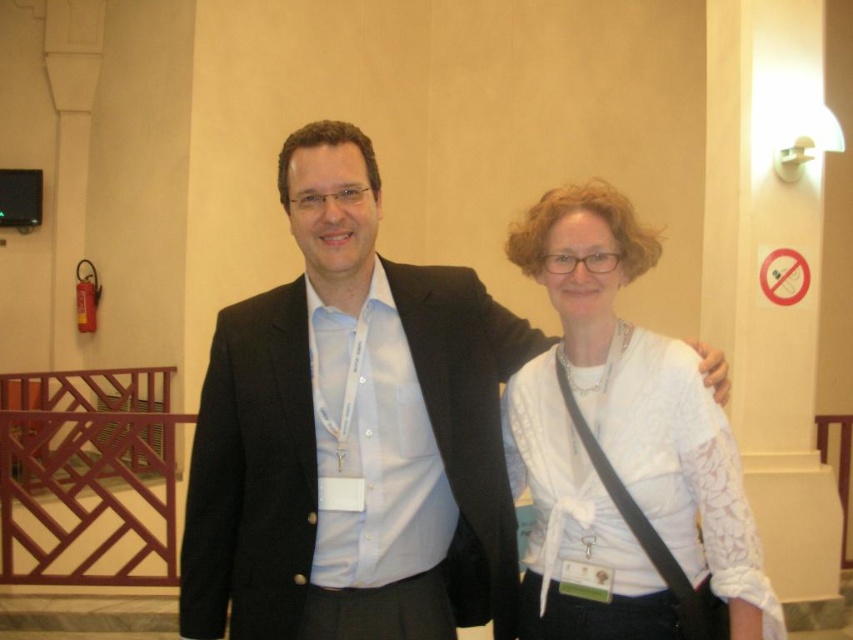
Question: Is the position of black matte suit at center less distant than that of white lace shirt at center?

Choices:
 (A) yes
 (B) no

Answer: (B)

Question: Where is black matte suit at center located in relation to white lace shirt at center in the image?

Choices:
 (A) left
 (B) right

Answer: (A)

Question: Which of the following is the closest to the observer?

Choices:
 (A) (727, 445)
 (B) (296, 452)

Answer: (A)

Question: Which of the following is the farthest from the observer?

Choices:
 (A) black matte suit at center
 (B) white lace shirt at center

Answer: (A)

Question: Can you confirm if black matte suit at center is positioned to the right of white lace shirt at center?

Choices:
 (A) no
 (B) yes

Answer: (A)